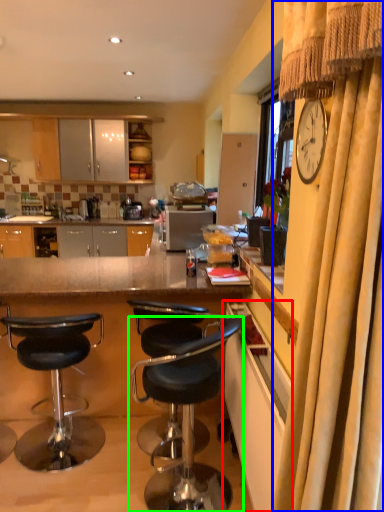
Question: Based on their relative distances, which object is nearer to cabinetry (highlighted by a red box)? Choose from curtain (highlighted by a blue box) and chair (highlighted by a green box).

Choices:
 (A) curtain
 (B) chair

Answer: (B)